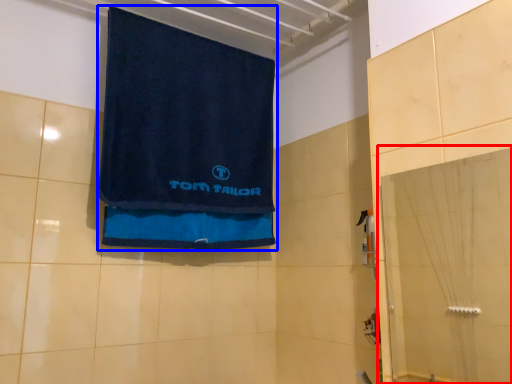
Question: Which of the following is the farthest to the observer, glass door (highlighted by a red box) or towel (highlighted by a blue box)?

Choices:
 (A) glass door
 (B) towel

Answer: (B)